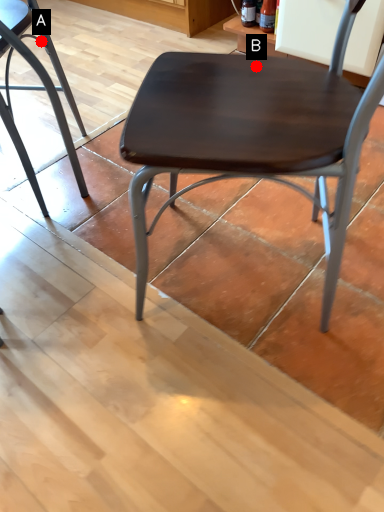
Question: Two points are circled on the image, labeled by A and B beside each circle. Which point is closer to the camera?

Choices:
 (A) A is closer
 (B) B is closer

Answer: (B)